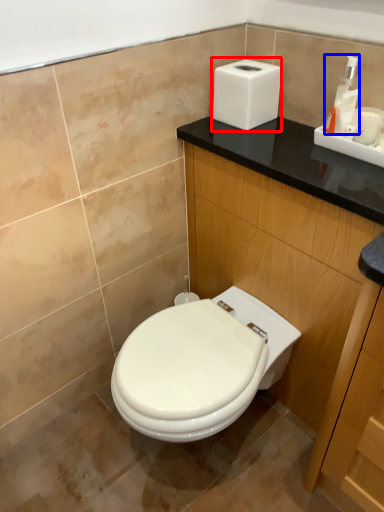
Question: Which object appears farthest to the camera in this image, hand dryer (highlighted by a red box) or soap dispenser (highlighted by a blue box)?

Choices:
 (A) hand dryer
 (B) soap dispenser

Answer: (A)